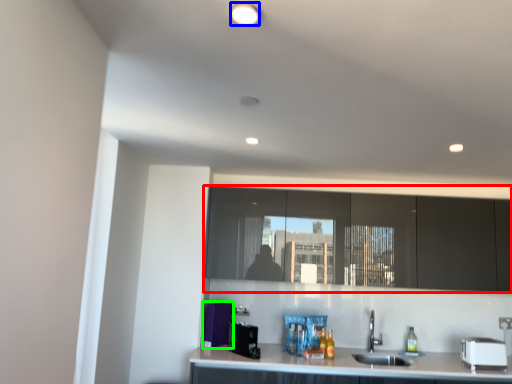
Question: Estimate the real-world distances between objects in this image. Which object is farther from cabinetry (highlighted by a red box), lighting (highlighted by a blue box) or appliance (highlighted by a green box)?

Choices:
 (A) lighting
 (B) appliance

Answer: (A)